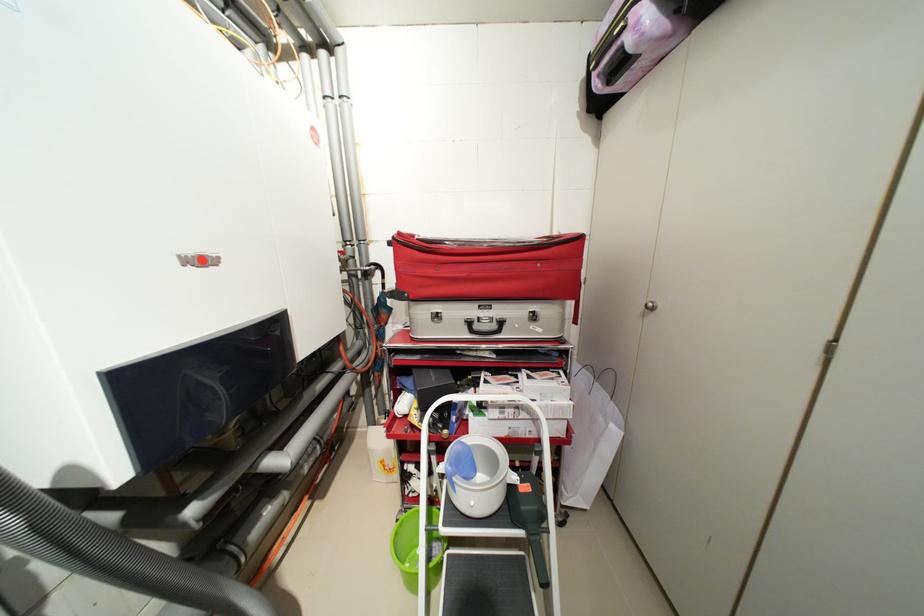
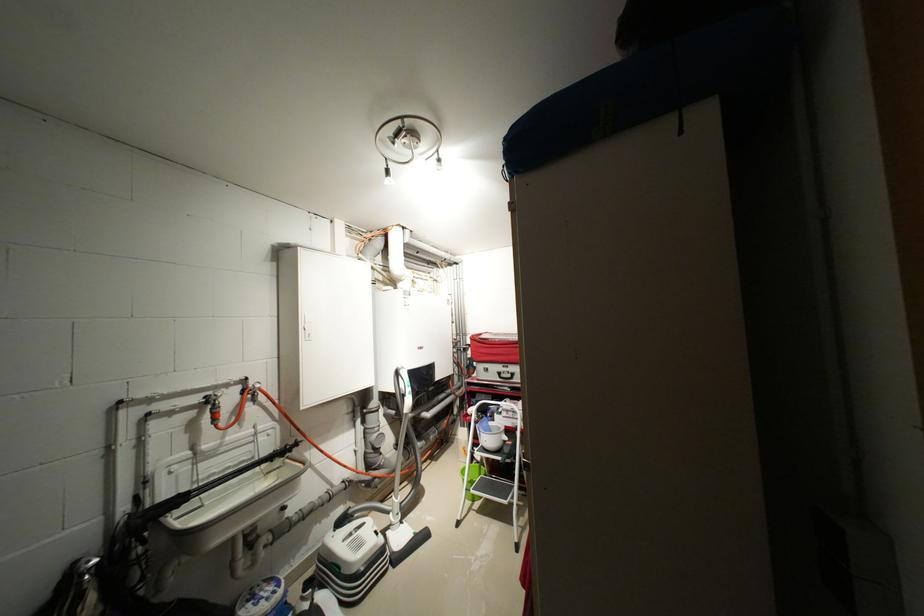
In the second image, find the point that corresponds to point 357,254 in the first image.

(466, 341)